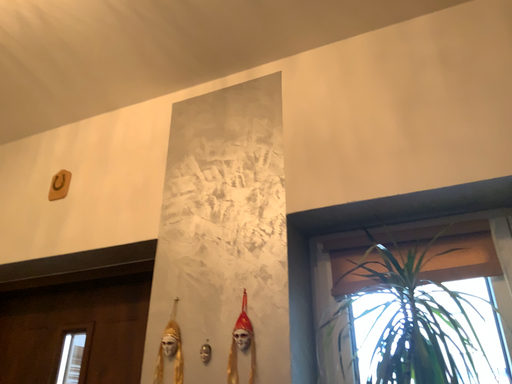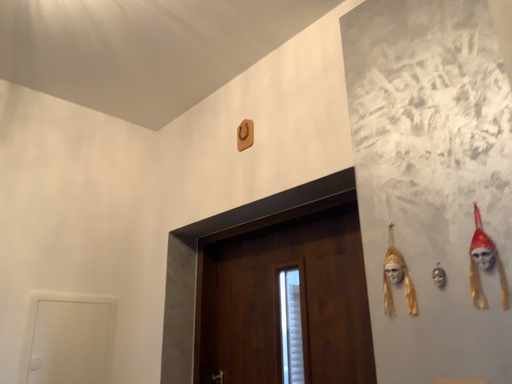
Question: How did the camera likely rotate when shooting the video?

Choices:
 (A) rotated upward
 (B) rotated downward

Answer: (B)